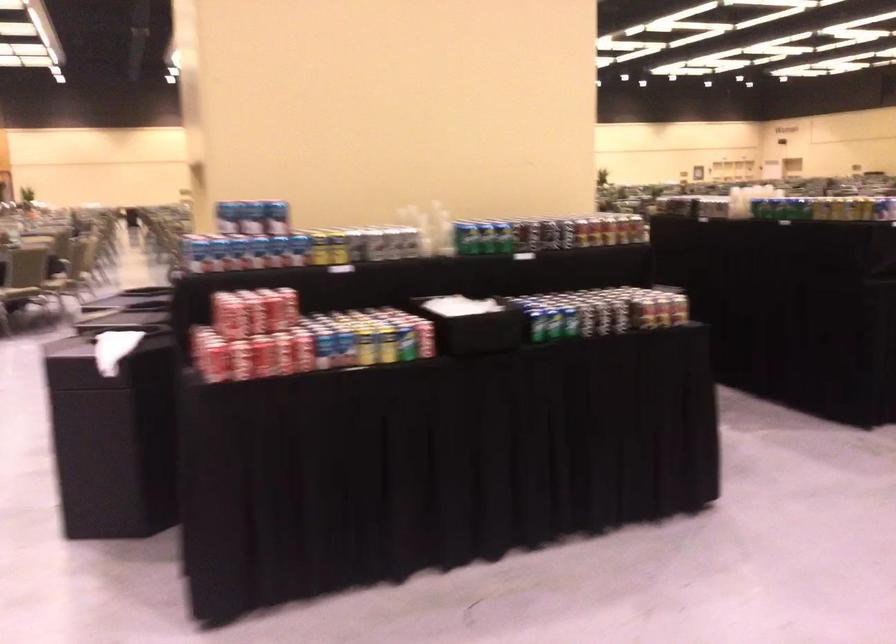
The location [736,203] corresponds to which object?

This point indicates the clear plastic cup.